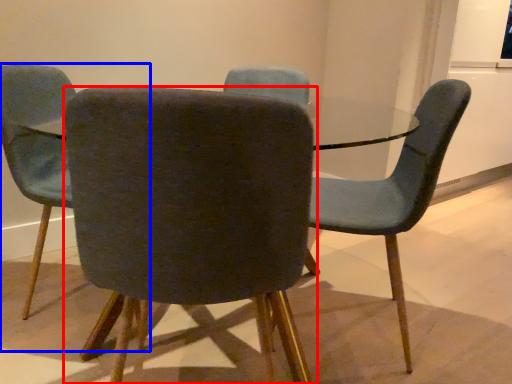
Question: Among these objects, which one is farthest to the camera, chair (highlighted by a red box) or chair (highlighted by a blue box)?

Choices:
 (A) chair
 (B) chair

Answer: (B)